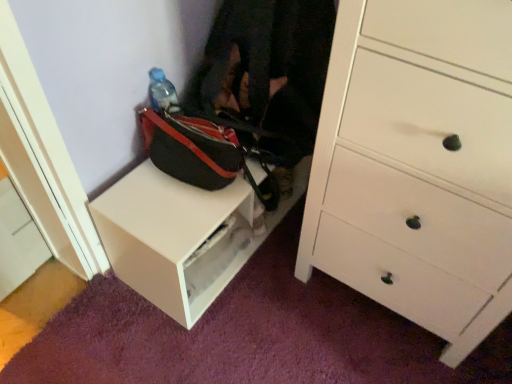
Question: From the image's perspective, is black fabric bag at center over white matte table at lower left?

Choices:
 (A) yes
 (B) no

Answer: (A)

Question: Is black fabric bag at center thinner than white matte table at lower left?

Choices:
 (A) yes
 (B) no

Answer: (B)

Question: Is black fabric bag at center facing towards white matte table at lower left?

Choices:
 (A) yes
 (B) no

Answer: (B)

Question: Considering the relative sizes of black fabric bag at center and white matte table at lower left in the image provided, is black fabric bag at center taller than white matte table at lower left?

Choices:
 (A) yes
 (B) no

Answer: (A)

Question: Does black fabric bag at center appear on the left side of white matte table at lower left?

Choices:
 (A) no
 (B) yes

Answer: (A)

Question: Can you confirm if black fabric bag at center is wider than white matte table at lower left?

Choices:
 (A) no
 (B) yes

Answer: (B)

Question: Is white wood chest of drawers at center right thinner than white matte table at lower left?

Choices:
 (A) yes
 (B) no

Answer: (B)

Question: Could you tell me if white wood chest of drawers at center right is facing white matte table at lower left?

Choices:
 (A) yes
 (B) no

Answer: (B)

Question: Is white wood chest of drawers at center right closer to the viewer compared to white matte table at lower left?

Choices:
 (A) yes
 (B) no

Answer: (A)

Question: From the image's perspective, is white wood chest of drawers at center right over white matte table at lower left?

Choices:
 (A) no
 (B) yes

Answer: (B)

Question: Could white matte table at lower left be considered to be inside white wood chest of drawers at center right?

Choices:
 (A) yes
 (B) no

Answer: (B)

Question: Is white wood chest of drawers at center right behind white matte table at lower left?

Choices:
 (A) yes
 (B) no

Answer: (B)

Question: Can you confirm if white matte table at lower left is positioned to the left of black fabric bag at center?

Choices:
 (A) yes
 (B) no

Answer: (A)